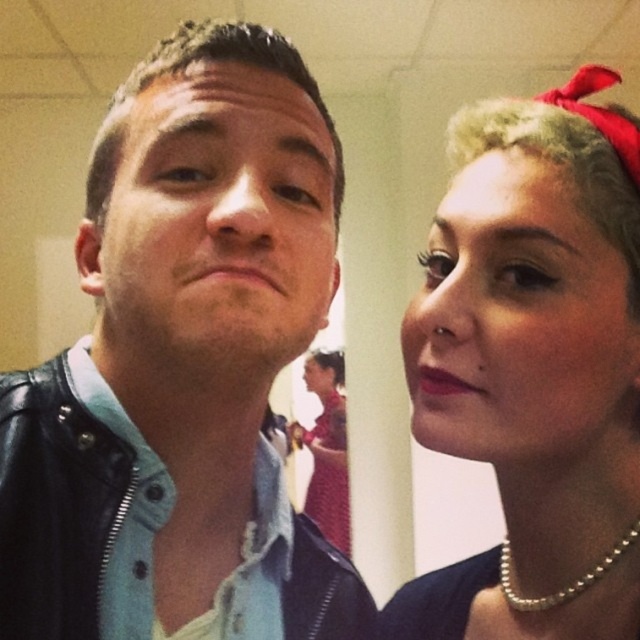
Question: Does pearl necklace at upper right appear over shiny red dress at center?

Choices:
 (A) no
 (B) yes

Answer: (B)

Question: Is the position of matte red headband at upper right less distant than that of matte black jacket at upper left?

Choices:
 (A) no
 (B) yes

Answer: (B)

Question: Which object is positioned closest to the pearl necklace at lower right?

Choices:
 (A) pearl necklace at upper right
 (B) leather jacket at left
 (C) matte black face at left

Answer: (A)

Question: Among these objects, which one is nearest to the camera?

Choices:
 (A) pearl necklace at upper right
 (B) matte black face at left
 (C) shiny red dress at center

Answer: (B)

Question: Does pearl necklace at upper right have a lesser width compared to pearl necklace at lower right?

Choices:
 (A) no
 (B) yes

Answer: (A)

Question: Which point appears farthest from the camera in this image?

Choices:
 (A) (182, 241)
 (B) (513, 449)
 (C) (534, 600)

Answer: (C)